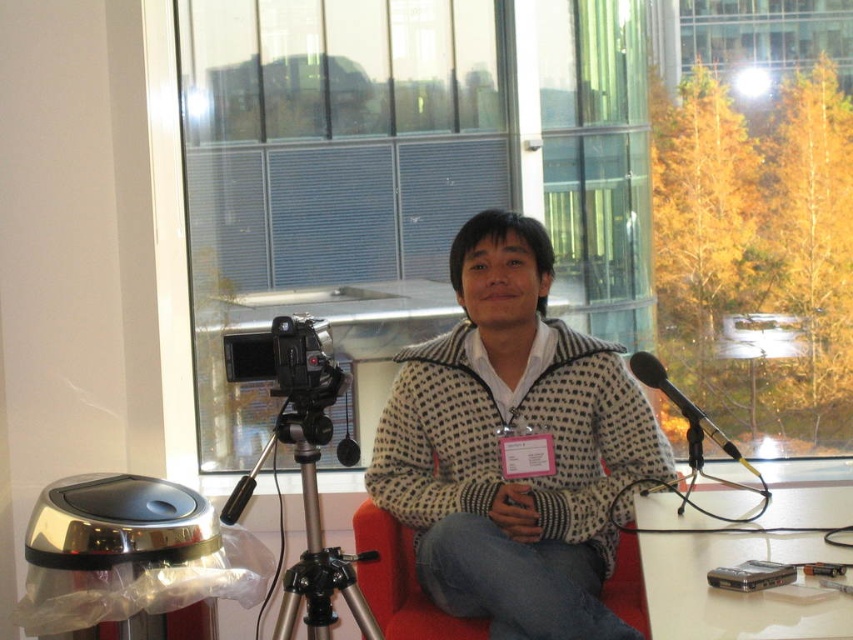
Who is taller, checkered sweater at center or silver metallic tripod at lower left?

With more height is checkered sweater at center.

Measure the distance between point (454, 403) and camera.

They are 6.99 feet apart.

Where is `checkered sweater at center`? The height and width of the screenshot is (640, 853). checkered sweater at center is located at coordinates (503, 436).

Between silver metallic tripod at lower left and metallic silver microphone at right, which one appears on the right side from the viewer's perspective?

Positioned to the right is metallic silver microphone at right.

This screenshot has width=853, height=640. Find the location of `silver metallic tripod at lower left`. silver metallic tripod at lower left is located at coordinates (308, 529).

This screenshot has height=640, width=853. Describe the element at coordinates (308, 529) in the screenshot. I see `silver metallic tripod at lower left` at that location.

Identify the location of silver metallic tripod at lower left. (308, 529).

Is checkered sweater at center closer to the viewer compared to red fabric armchair at center?

That is True.

The width and height of the screenshot is (853, 640). I want to click on checkered sweater at center, so click(x=503, y=436).